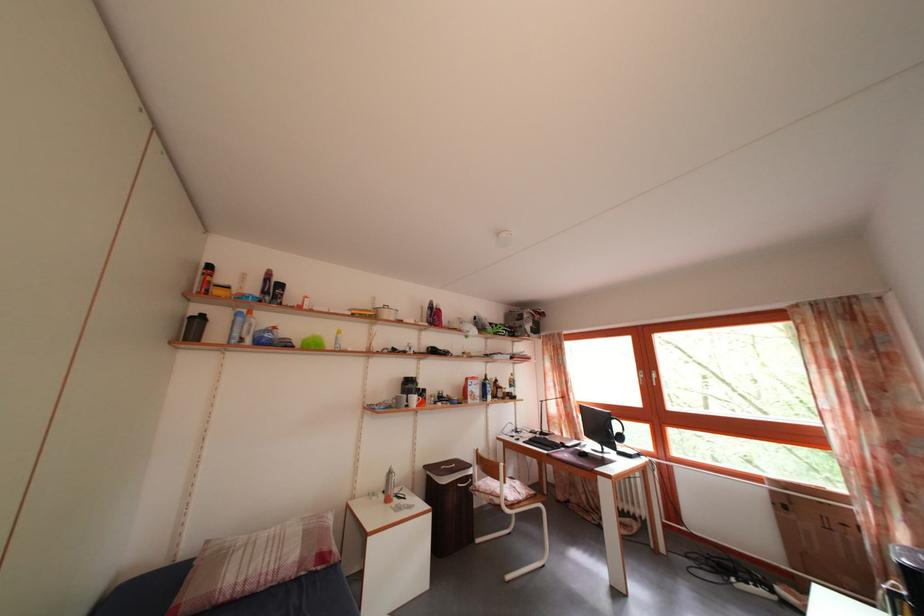
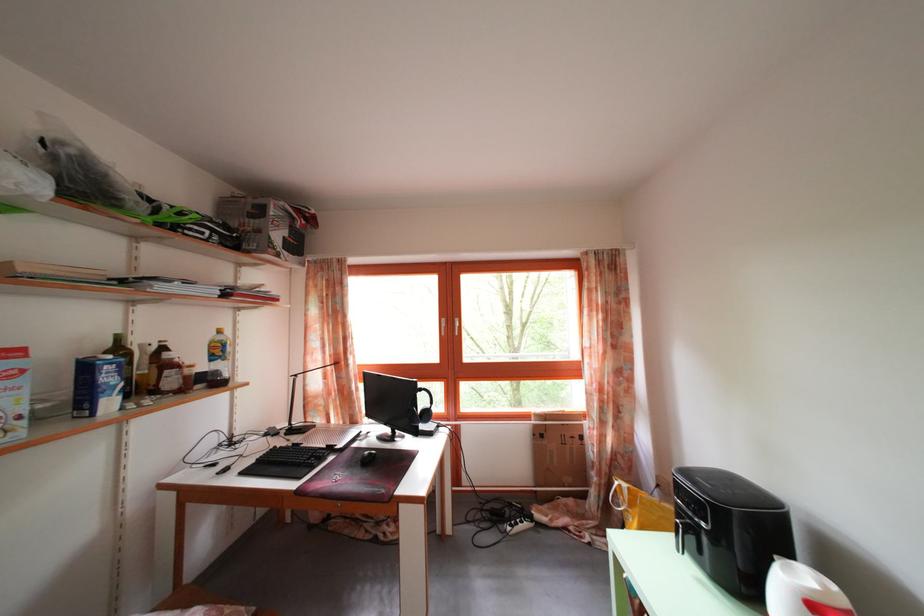
Question: I am providing you with two images of the same scene from different viewpoints. Please identify which objects are invisible in image2.

Choices:
 (A) grey dish brush
 (B) black headphones
 (C) black computer mouse
 (D) blue milk carton

Answer: (B)